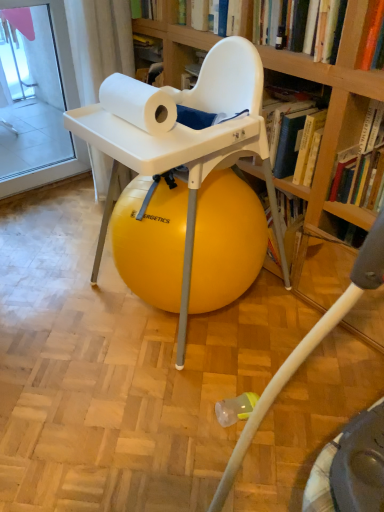
Question: From a real-world perspective, is hardcover book at upper right, which is the second book in top-to-bottom order, physically below hardcover book at upper center, the 2th book positioned from the bottom?

Choices:
 (A) no
 (B) yes

Answer: (B)

Question: From the image's perspective, is hardcover book at upper right, acting as the 1th book starting from the right, below hardcover book at upper center, the 2th book positioned from the bottom?

Choices:
 (A) yes
 (B) no

Answer: (A)

Question: Is hardcover book at upper right, which appears as the second book when viewed from the left, facing away from hardcover book at upper center, the 2th book positioned from the bottom?

Choices:
 (A) yes
 (B) no

Answer: (B)

Question: From the image's perspective, would you say hardcover book at upper right, acting as the 1th book starting from the right, is positioned over hardcover book at upper center, arranged as the 1th book when viewed from the left?

Choices:
 (A) no
 (B) yes

Answer: (A)

Question: Can you confirm if hardcover book at upper right, acting as the 1th book starting from the bottom, is positioned to the right of hardcover book at upper center, the 2th book positioned from the bottom?

Choices:
 (A) no
 (B) yes

Answer: (B)

Question: Does hardcover book at upper right, acting as the 1th book starting from the bottom, have a greater width compared to hardcover book at upper center, the 2th book positioned from the bottom?

Choices:
 (A) no
 (B) yes

Answer: (A)

Question: Considering the relative sizes of yellow rubber ball at center and hardcover book at upper right, which is the second book in top-to-bottom order, in the image provided, is yellow rubber ball at center shorter than hardcover book at upper right, which is the second book in top-to-bottom order,?

Choices:
 (A) yes
 (B) no

Answer: (B)

Question: Could hardcover book at upper right, which appears as the second book when viewed from the left, be considered to be inside yellow rubber ball at center?

Choices:
 (A) yes
 (B) no

Answer: (B)

Question: From the image's perspective, would you say yellow rubber ball at center is positioned over hardcover book at upper right, acting as the 1th book starting from the right?

Choices:
 (A) yes
 (B) no

Answer: (B)

Question: Does yellow rubber ball at center turn towards hardcover book at upper right, which appears as the second book when viewed from the left?

Choices:
 (A) no
 (B) yes

Answer: (A)

Question: Are yellow rubber ball at center and hardcover book at upper right, acting as the 1th book starting from the bottom, making contact?

Choices:
 (A) yes
 (B) no

Answer: (B)

Question: Is yellow rubber ball at center oriented away from hardcover book at upper right, which is the second book in top-to-bottom order?

Choices:
 (A) no
 (B) yes

Answer: (A)

Question: Is hardcover book at upper center, the 2th book positioned from the bottom, completely or partially inside white matte paper towel at upper center?

Choices:
 (A) yes
 (B) no

Answer: (B)